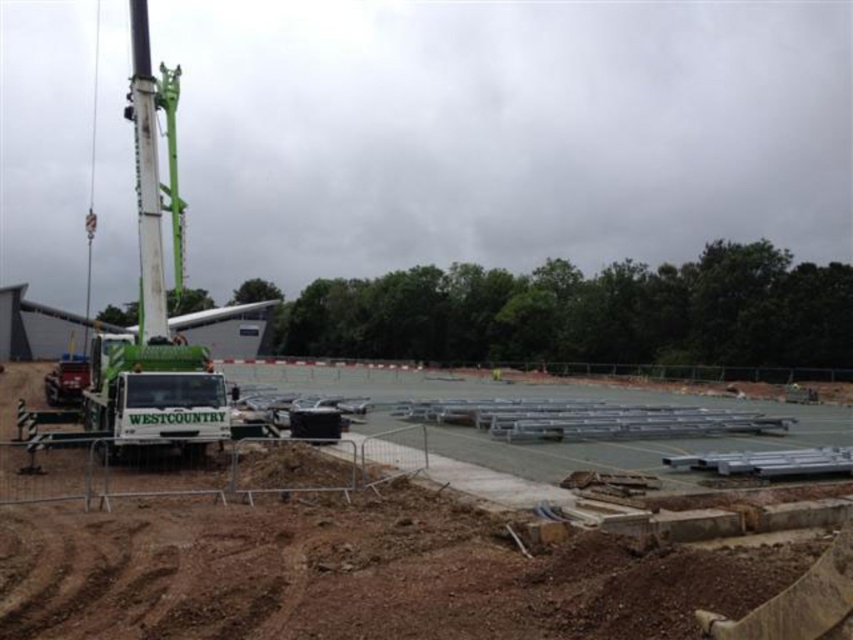
Between point (340, 451) and point (178, 397), which one is positioned in front?

Point (178, 397) is more forward.

Is point (70, 563) positioned behind point (86, 401)?

No, it is in front of (86, 401).

This screenshot has width=853, height=640. What are the coordinates of `white metallic scaffolding at center` in the screenshot? It's located at (347, 554).